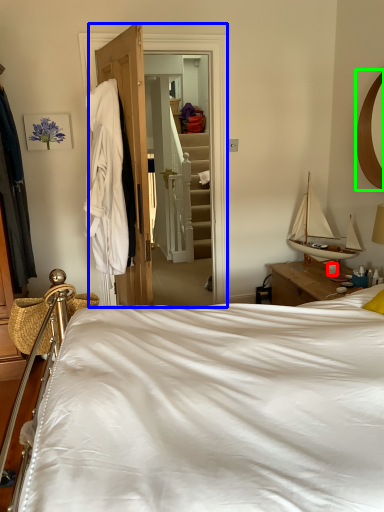
Question: Which object is the closest to the coffee cup (highlighted by a red box)? Choose among these: closet (highlighted by a blue box) or mirror (highlighted by a green box).

Choices:
 (A) closet
 (B) mirror

Answer: (B)